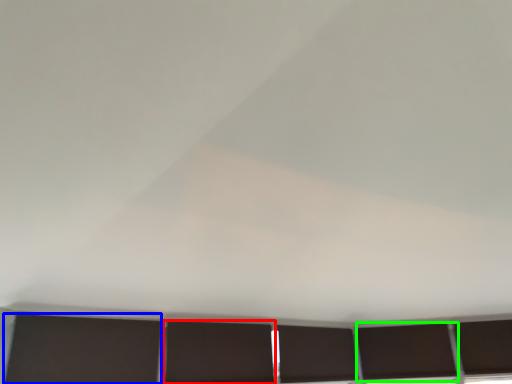
Question: Based on their relative distances, which object is nearer to shutter (highlighted by a red box)? Choose from shutter (highlighted by a blue box) and window (highlighted by a green box).

Choices:
 (A) shutter
 (B) window

Answer: (A)